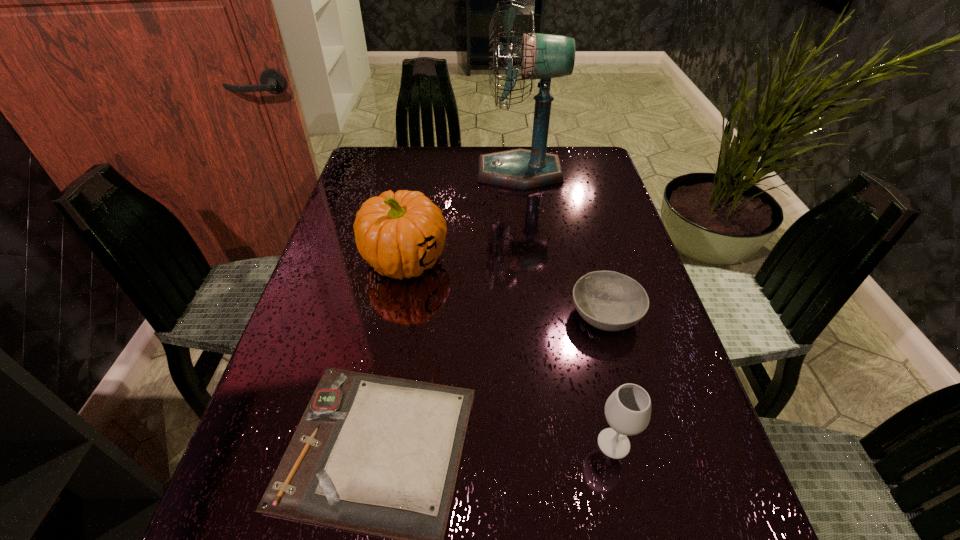
Locate an element on the screen. the tallest object is located at coordinates (543, 56).

Locate an element on the screen. fan is located at coordinates (543, 56).

Identify the location of pumpkin. The image size is (960, 540). (400, 235).

The width and height of the screenshot is (960, 540). In order to click on wineglass in this screenshot , I will do pos(628,409).

You are a GUI agent. You are given a task and a screenshot of the screen. Output one action in this format:
    pyautogui.click(x=<x>, y=<y>)
    Task: Click on the bowl
    
    Given the screenshot: What is the action you would take?
    coord(611,301)

Where is `free space located 0.170m in front of the farthest object where the wind blows`? free space located 0.170m in front of the farthest object where the wind blows is located at coordinates (422, 172).

Find the location of `free space located 0.250m in front of the farthest object where the wind blows`. free space located 0.250m in front of the farthest object where the wind blows is located at coordinates (397, 172).

This screenshot has height=540, width=960. In order to click on vacant region located 0.360m in front of the farthest object where the wind blows in this screenshot , I will do `click(362, 172)`.

The height and width of the screenshot is (540, 960). What are the coordinates of `free point located on the surface of the pumpkin` in the screenshot? It's located at (374, 429).

Where is `vacant space situated 0.180m on the back of the wineglass`? Image resolution: width=960 pixels, height=540 pixels. vacant space situated 0.180m on the back of the wineglass is located at coordinates (591, 342).